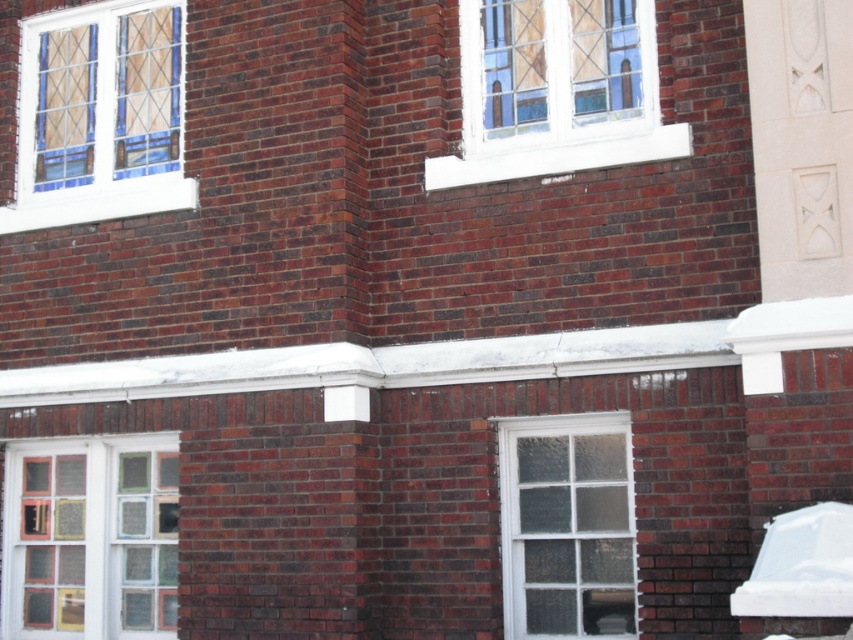
Question: Observing the image, what is the correct spatial positioning of multicolored glass window at lower left in reference to clear glass window at upper center?

Choices:
 (A) above
 (B) below

Answer: (B)

Question: Which point is farther from the camera taking this photo?

Choices:
 (A) (604, 44)
 (B) (102, 604)

Answer: (B)

Question: Which of the following is the closest to the observer?

Choices:
 (A) (49, 77)
 (B) (57, 547)
 (C) (601, 582)
 (D) (480, 141)

Answer: (C)

Question: Is multicolored glass window at lower left to the left of clear glass window at upper center from the viewer's perspective?

Choices:
 (A) no
 (B) yes

Answer: (B)

Question: Is stained glass window at upper left above clear glass window at upper center?

Choices:
 (A) yes
 (B) no

Answer: (B)

Question: Which object is closer to the camera taking this photo?

Choices:
 (A) clear glass window at upper center
 (B) multicolored glass window at lower left

Answer: (A)